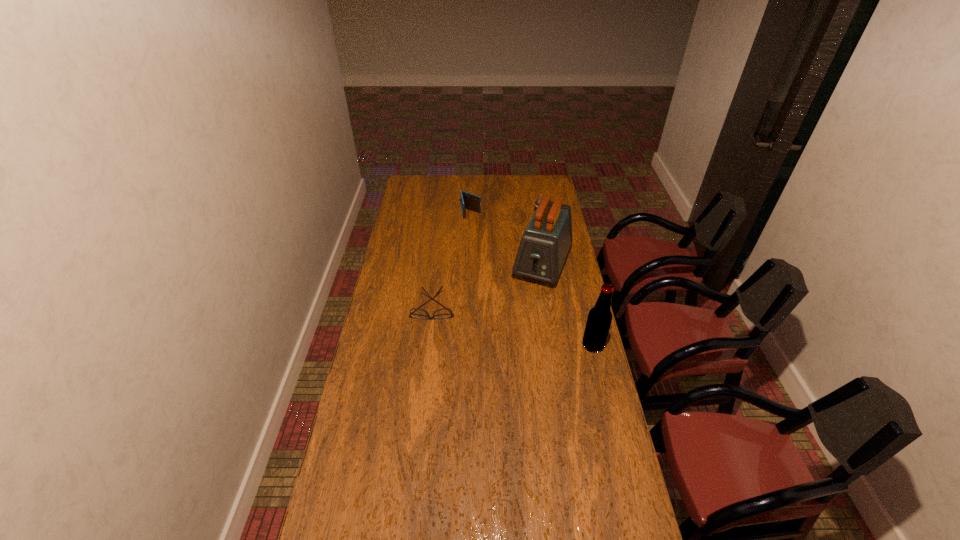
Find the location of a particular element. This screenshot has height=540, width=960. vacant space positioned on the front-facing side of the kitten is located at coordinates (534, 252).

Find the location of a particular element. vacant area situated 0.080m on the exterior surface of the wallet is located at coordinates (474, 228).

Where is `vacant space located 0.250m on the exterior surface of the wallet`? Image resolution: width=960 pixels, height=540 pixels. vacant space located 0.250m on the exterior surface of the wallet is located at coordinates (478, 247).

You are a GUI agent. You are given a task and a screenshot of the screen. Output one action in this format:
    pyautogui.click(x=<x>, y=<y>)
    Task: Click on the free space located on the exterior surface of the wallet
    
    Given the screenshot: What is the action you would take?
    pyautogui.click(x=482, y=264)

Identify the location of vacant area situated 0.280m on the front-facing side of the third nearest object. (516, 334).

Where is `free space located on the front-facing side of the third nearest object`? Image resolution: width=960 pixels, height=540 pixels. free space located on the front-facing side of the third nearest object is located at coordinates (525, 311).

Image resolution: width=960 pixels, height=540 pixels. Find the location of `free point located 0.370m on the front-facing side of the third nearest object`. free point located 0.370m on the front-facing side of the third nearest object is located at coordinates (508, 350).

You are a GUI agent. You are given a task and a screenshot of the screen. Output one action in this format:
    pyautogui.click(x=<x>, y=<y>)
    Task: Click on the object located at the left edge
    The image size is (960, 540).
    Given the screenshot: What is the action you would take?
    pyautogui.click(x=443, y=313)

At what (x,y) coordinates should I click in order to perform the action: click on beer bottle present at the right edge. Please return your answer as a coordinate pair (x, y). The width and height of the screenshot is (960, 540). Looking at the image, I should click on 599,319.

The image size is (960, 540). What are the coordinates of `kitten that is at the right edge` in the screenshot? It's located at (540, 199).